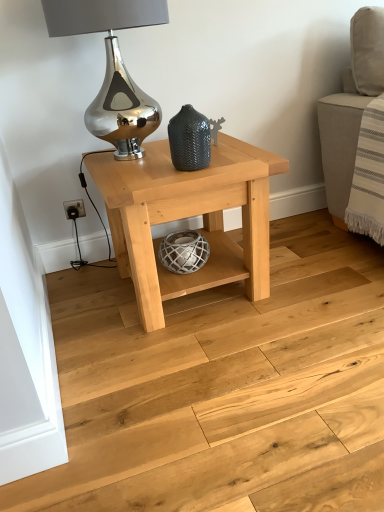
Identify the location of free spot to the right of matte dark gray textured vase at center. (236, 160).